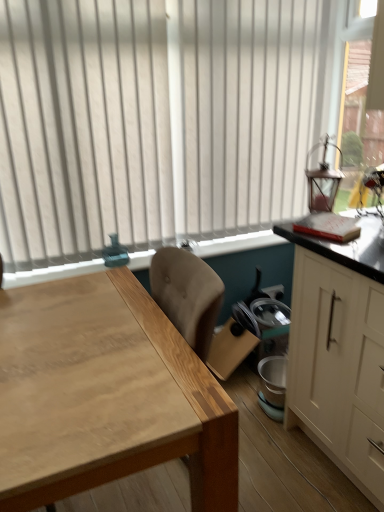
Question: Can you confirm if white matte cabinet at right is taller than white vertical blinds at upper center?

Choices:
 (A) yes
 (B) no

Answer: (B)

Question: Is white matte cabinet at right aimed at white vertical blinds at upper center?

Choices:
 (A) yes
 (B) no

Answer: (B)

Question: Can you confirm if white matte cabinet at right is shorter than white vertical blinds at upper center?

Choices:
 (A) yes
 (B) no

Answer: (A)

Question: Is white matte cabinet at right positioned with its back to white vertical blinds at upper center?

Choices:
 (A) no
 (B) yes

Answer: (A)

Question: From the image's perspective, is white matte cabinet at right beneath white vertical blinds at upper center?

Choices:
 (A) yes
 (B) no

Answer: (A)

Question: Would you say clear glass lantern at upper right is to the left or to the right of white matte cabinet at right in the picture?

Choices:
 (A) left
 (B) right

Answer: (B)

Question: Is clear glass lantern at upper right wider or thinner than white matte cabinet at right?

Choices:
 (A) thin
 (B) wide

Answer: (A)

Question: Considering the positions of clear glass lantern at upper right and white matte cabinet at right in the image, is clear glass lantern at upper right taller or shorter than white matte cabinet at right?

Choices:
 (A) tall
 (B) short

Answer: (A)

Question: From the image's perspective, is clear glass lantern at upper right positioned above or below white matte cabinet at right?

Choices:
 (A) above
 (B) below

Answer: (A)

Question: From the image's perspective, relative to white vertical blinds at upper center, is natural wood table at center above or below?

Choices:
 (A) above
 (B) below

Answer: (B)

Question: Considering the positions of natural wood table at center and white vertical blinds at upper center in the image, is natural wood table at center bigger or smaller than white vertical blinds at upper center?

Choices:
 (A) big
 (B) small

Answer: (A)

Question: Which is correct: natural wood table at center is inside white vertical blinds at upper center, or outside of it?

Choices:
 (A) inside
 (B) outside

Answer: (B)

Question: In the image, is natural wood table at center positioned in front of or behind white vertical blinds at upper center?

Choices:
 (A) front
 (B) behind

Answer: (A)

Question: Is point (135, 282) closer or farther from the camera than point (283, 230)?

Choices:
 (A) farther
 (B) closer

Answer: (B)

Question: From a real-world perspective, is natural wood table at center above or below white matte cabinet at right?

Choices:
 (A) below
 (B) above

Answer: (A)